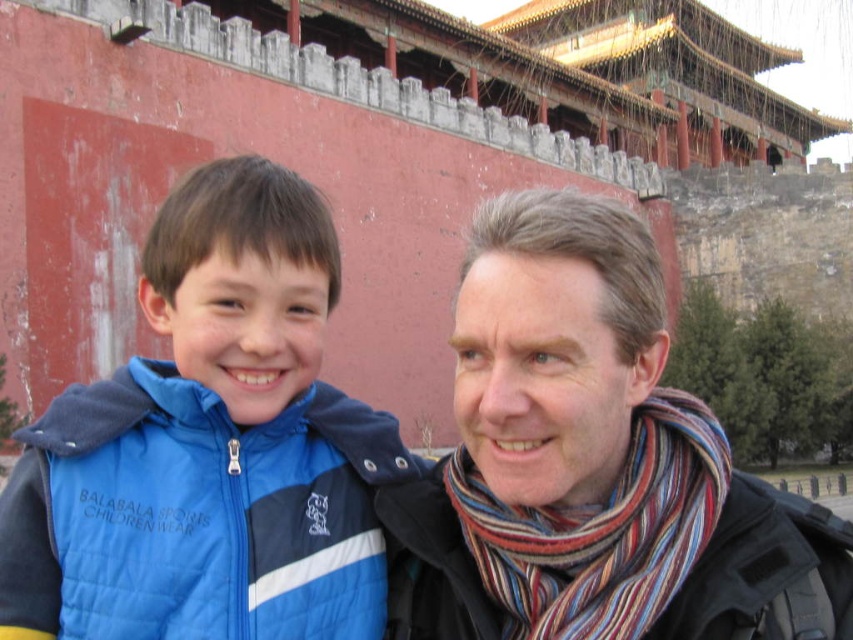
Can you confirm if blue quilted vest at left is bigger than striped wool scarf at right?

Correct, blue quilted vest at left is larger in size than striped wool scarf at right.

Can you confirm if blue quilted vest at left is positioned below striped wool scarf at right?

No.

Is point (279, 445) less distant than point (421, 572)?

That is False.

Identify the location of blue quilted vest at left. (209, 445).

Looking at this image, who is more distant from viewer, (x=585, y=476) or (x=705, y=598)?

Point (x=585, y=476)

Consider the image. Is striped scarf at center above striped wool scarf at right?

Yes, striped scarf at center is above striped wool scarf at right.

Is point (679, 618) positioned before point (741, 544)?

Yes.

At what (x,y) coordinates should I click in order to perform the action: click on striped scarf at center. Please return your answer as a coordinate pair (x, y). Image resolution: width=853 pixels, height=640 pixels. Looking at the image, I should click on (590, 461).

Is blue quilted vest at left taller than striped scarf at center?

No, blue quilted vest at left is not taller than striped scarf at center.

Is blue quilted vest at left bigger than striped scarf at center?

Actually, blue quilted vest at left might be smaller than striped scarf at center.

Who is more forward, (x=73, y=598) or (x=573, y=621)?

Positioned in front is point (x=573, y=621).

Locate an element on the screen. The image size is (853, 640). blue quilted vest at left is located at coordinates (209, 445).